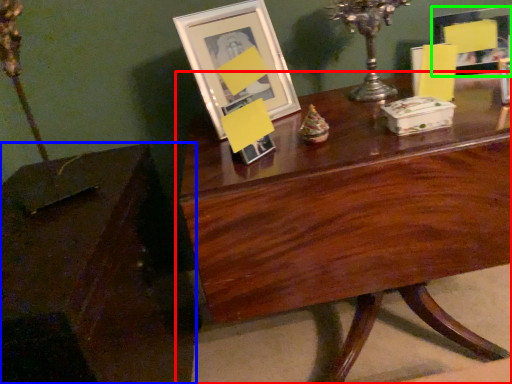
Question: Which object is the farthest from table (highlighted by a red box)? Choose among these: table (highlighted by a blue box) or picture frame (highlighted by a green box).

Choices:
 (A) table
 (B) picture frame

Answer: (B)